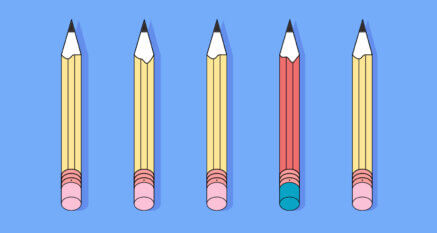
Where is `blue table`? blue table is located at coordinates (199, 109).